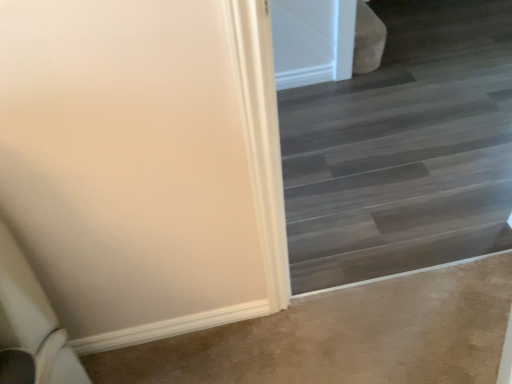
Question: From the image's perspective, is brown carpet at lower left positioned above or below dark wood floor at center?

Choices:
 (A) below
 (B) above

Answer: (A)

Question: From a real-world perspective, is brown carpet at lower left above or below dark wood floor at center?

Choices:
 (A) below
 (B) above

Answer: (A)

Question: In terms of width, does brown carpet at lower left look wider or thinner when compared to dark wood floor at center?

Choices:
 (A) thin
 (B) wide

Answer: (B)

Question: Considering the positions of point (502, 89) and point (438, 342), is point (502, 89) closer or farther from the camera than point (438, 342)?

Choices:
 (A) farther
 (B) closer

Answer: (A)

Question: In terms of width, does dark wood floor at center look wider or thinner when compared to brown carpet at lower left?

Choices:
 (A) wide
 (B) thin

Answer: (B)

Question: Choose the correct answer: Is dark wood floor at center inside brown carpet at lower left or outside it?

Choices:
 (A) outside
 (B) inside

Answer: (A)

Question: Looking at the image, does dark wood floor at center seem bigger or smaller compared to brown carpet at lower left?

Choices:
 (A) small
 (B) big

Answer: (B)